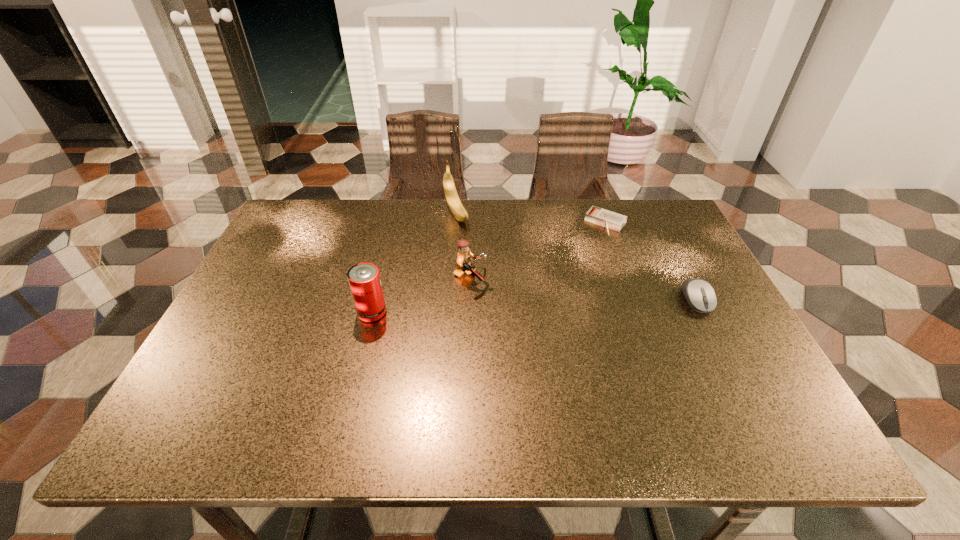
Locate an element on the screen. The height and width of the screenshot is (540, 960). object that ranks as the closest to the third shortest object is located at coordinates (456, 207).

Locate an element on the screen. This screenshot has width=960, height=540. vacant point that satisfies the following two spatial constraints: 1. on the front side of the Lego; 2. on the left side of the tallest object is located at coordinates (451, 279).

Image resolution: width=960 pixels, height=540 pixels. Identify the location of vacant position in the image that satisfies the following two spatial constraints: 1. on the back side of the second tallest object; 2. on the right side of the Lego. (380, 279).